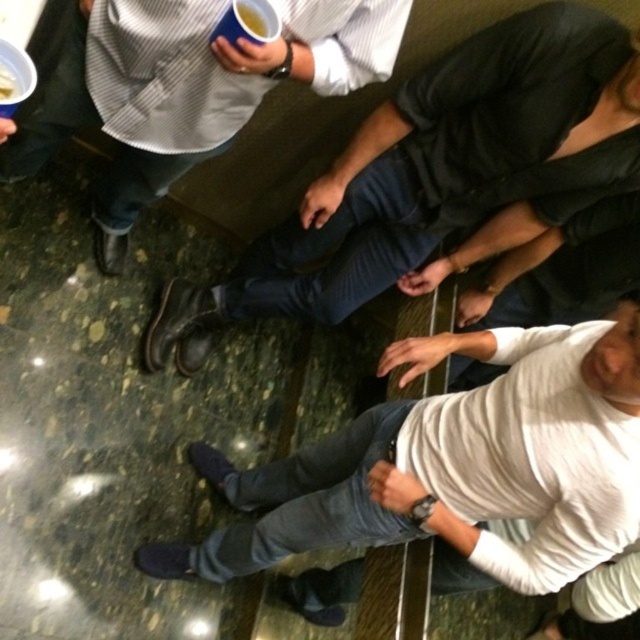
Question: Observing the image, what is the correct spatial positioning of dark gray jeans at center in reference to white paper cup at upper left?

Choices:
 (A) above
 (B) below

Answer: (B)

Question: Is striped cotton shirt at upper center to the left of blue paper cup at upper center from the viewer's perspective?

Choices:
 (A) yes
 (B) no

Answer: (A)

Question: Based on their relative distances, which object is nearer to the dark brown leather shoes at lower left?

Choices:
 (A) dark gray jeans at center
 (B) blue paper cup at upper center
 (C) striped cotton shirt at upper center
 (D) white paper cup at upper left

Answer: (C)

Question: Which of the following is the closest to the observer?

Choices:
 (A) (534, 387)
 (B) (10, 84)

Answer: (B)

Question: Which of the following is the farthest from the observer?

Choices:
 (A) (589, 522)
 (B) (221, 13)

Answer: (A)

Question: Is striped cotton shirt at upper center to the left of white paper cup at upper left from the viewer's perspective?

Choices:
 (A) no
 (B) yes

Answer: (A)